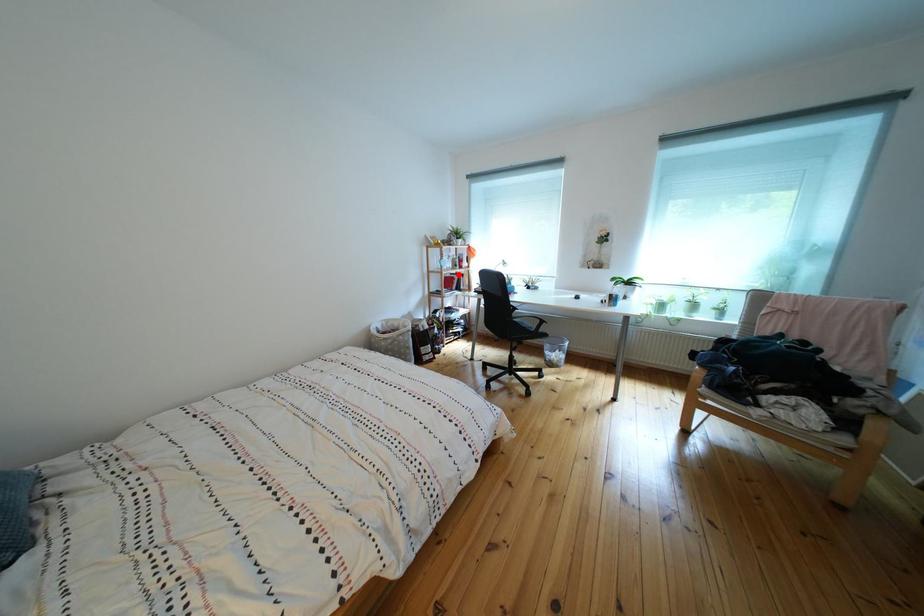
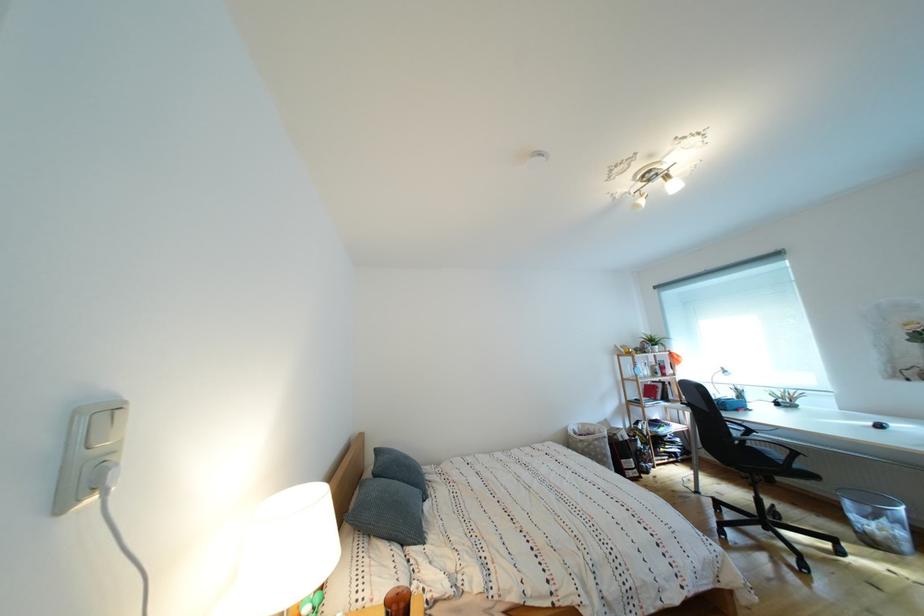
Find the pixel in the second image that matches the highlighted location in the first image.

(657, 383)